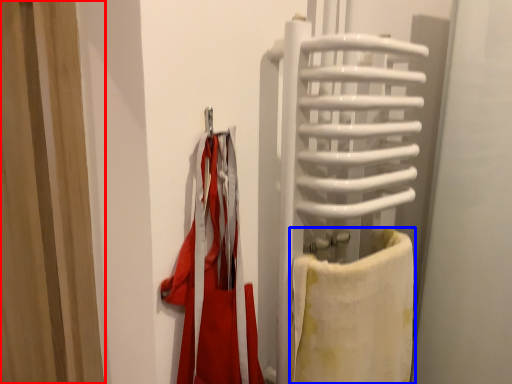
Question: Which object appears closest to the camera in this image, curtain (highlighted by a red box) or towel (highlighted by a blue box)?

Choices:
 (A) curtain
 (B) towel

Answer: (B)